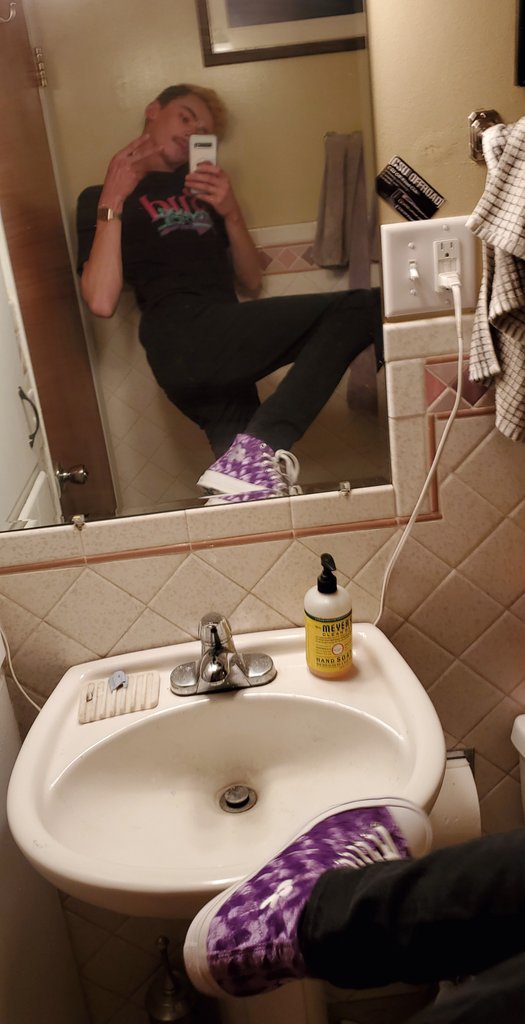
Find the location of a particular element. This screenshot has height=1024, width=525. toilet paper is located at coordinates (459, 840).